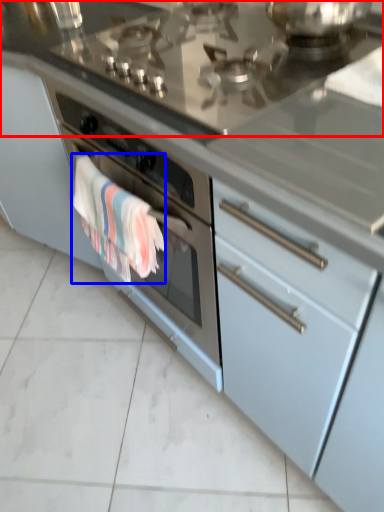
Question: Among these objects, which one is farthest to the camera, countertop (highlighted by a red box) or bath towel (highlighted by a blue box)?

Choices:
 (A) countertop
 (B) bath towel

Answer: (B)